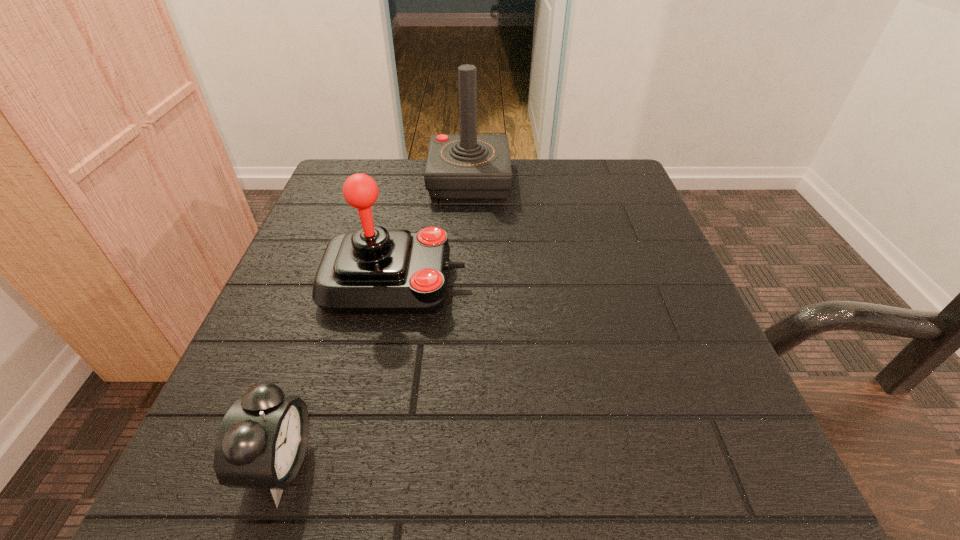
Where is `vacant space that's between the shorter joystick and the shortest object`? Image resolution: width=960 pixels, height=540 pixels. vacant space that's between the shorter joystick and the shortest object is located at coordinates (337, 373).

At what (x,y) coordinates should I click in order to perform the action: click on free space that is in between the nearer joystick and the shortest object. Please return your answer as a coordinate pair (x, y). Looking at the image, I should click on (337, 373).

Where is `vacant area that lies between the nearest object and the tallest object`? Image resolution: width=960 pixels, height=540 pixels. vacant area that lies between the nearest object and the tallest object is located at coordinates (374, 322).

Where is `free point between the nearer joystick and the nearest object`? free point between the nearer joystick and the nearest object is located at coordinates (337, 373).

This screenshot has width=960, height=540. Find the location of `vacant space in between the shorter joystick and the shortest object`. vacant space in between the shorter joystick and the shortest object is located at coordinates (337, 373).

Where is `free space between the alarm clock and the second tallest object`? Image resolution: width=960 pixels, height=540 pixels. free space between the alarm clock and the second tallest object is located at coordinates (337, 373).

What are the coordinates of `object that ranks as the second closest to the farther joystick` in the screenshot? It's located at coord(261,444).

You are a GUI agent. You are given a task and a screenshot of the screen. Output one action in this format:
    pyautogui.click(x=<x>, y=<y>)
    Task: Click on the object that stands as the second closest to the shorter joystick
    Image resolution: width=960 pixels, height=540 pixels.
    Given the screenshot: What is the action you would take?
    pyautogui.click(x=261, y=444)

Locate an element on the screen. The width and height of the screenshot is (960, 540). free space in the image that satisfies the following two spatial constraints: 1. on the rectangular base of the farthest object; 2. on the front side of the shortest object is located at coordinates (460, 463).

Locate an element on the screen. The width and height of the screenshot is (960, 540). vacant position in the image that satisfies the following two spatial constraints: 1. on the rectangular base of the taller joystick; 2. on the front side of the nearest object is located at coordinates tap(460, 463).